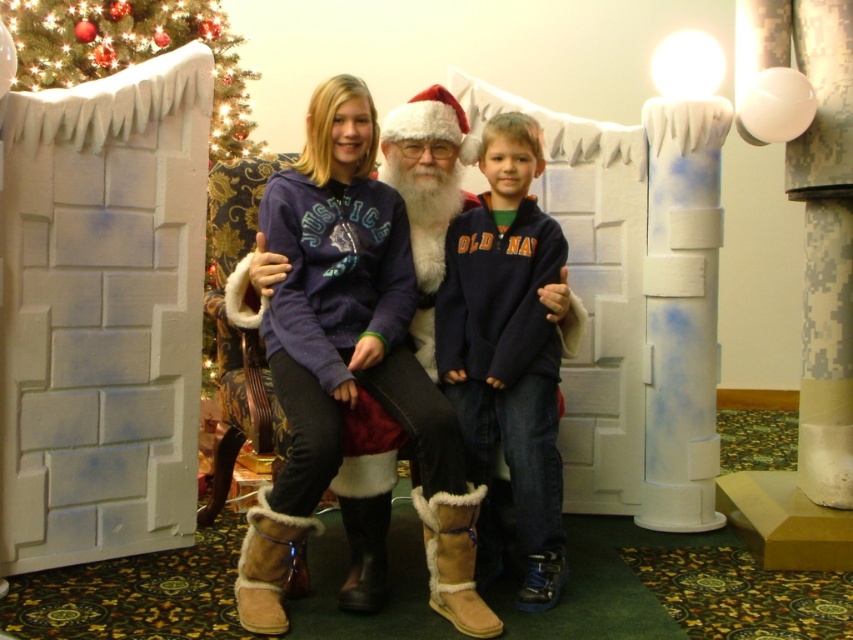
You are standing in front of the festive scene and want to take a photo of the white painted wood pillar at right. Where exactly should you position yourself to capture it in the frame?

The white painted wood pillar at right is located at point 0.489 on the horizontal axis and 0.800 on the vertical axis, so you should position yourself directly in front of these coordinates to capture it in the frame.

You are standing in front of the festive scene and want to know which object is higher up. Which is higher, the navy fleece sweatshirt at center or the green artificial christmas tree at upper left?

The green artificial christmas tree at upper left is higher up than the navy fleece sweatshirt at center because the navy fleece sweatshirt at center is positioned below it.